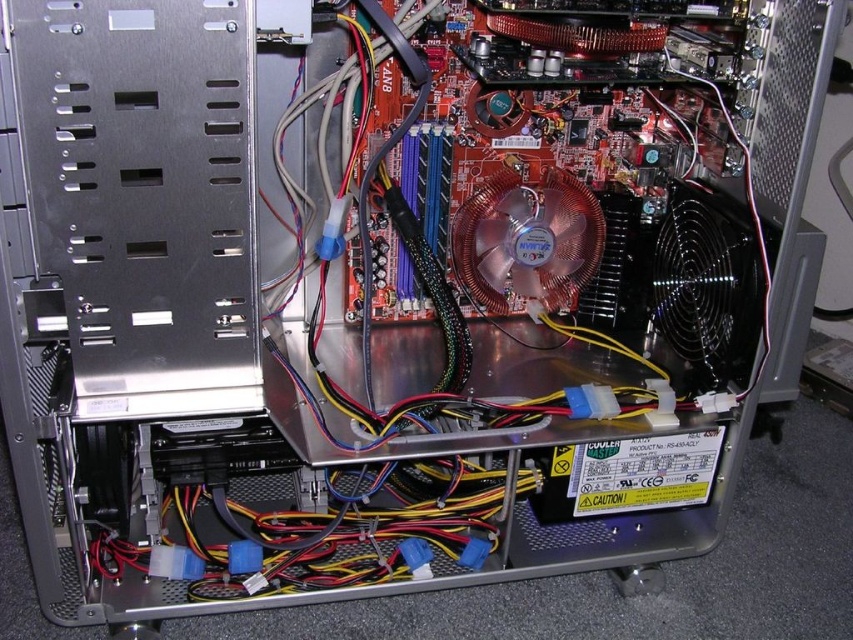
Question: Does black metallic fan at right appear on the right side of copper/brass fan at center?

Choices:
 (A) yes
 (B) no

Answer: (A)

Question: Does black metallic fan at right have a smaller size compared to copper/brass fan at center?

Choices:
 (A) no
 (B) yes

Answer: (B)

Question: Among these points, which one is farthest from the camera?

Choices:
 (A) (697, 189)
 (B) (532, 269)

Answer: (B)

Question: Considering the relative positions of black metallic fan at right and copper/brass fan at center in the image provided, where is black metallic fan at right located with respect to copper/brass fan at center?

Choices:
 (A) right
 (B) left

Answer: (A)